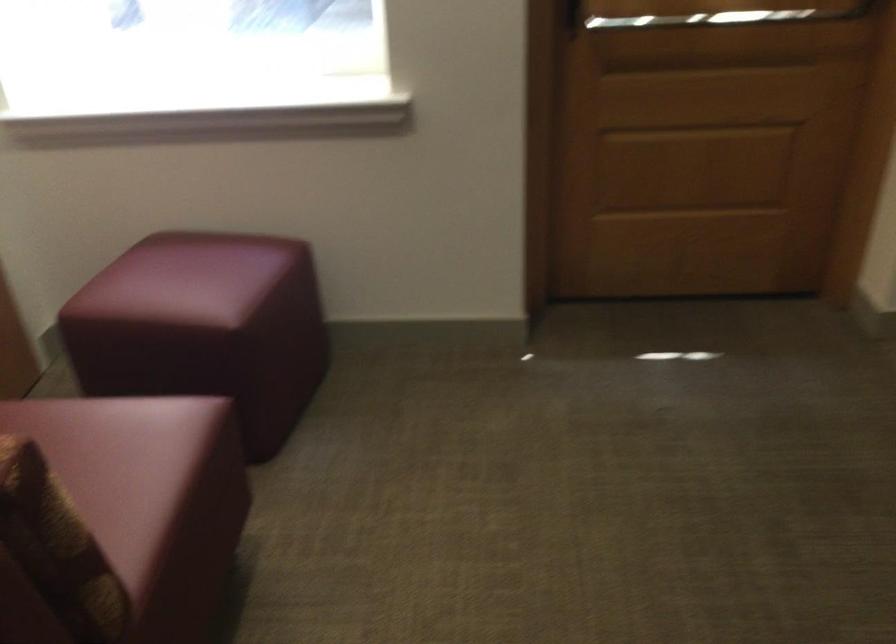
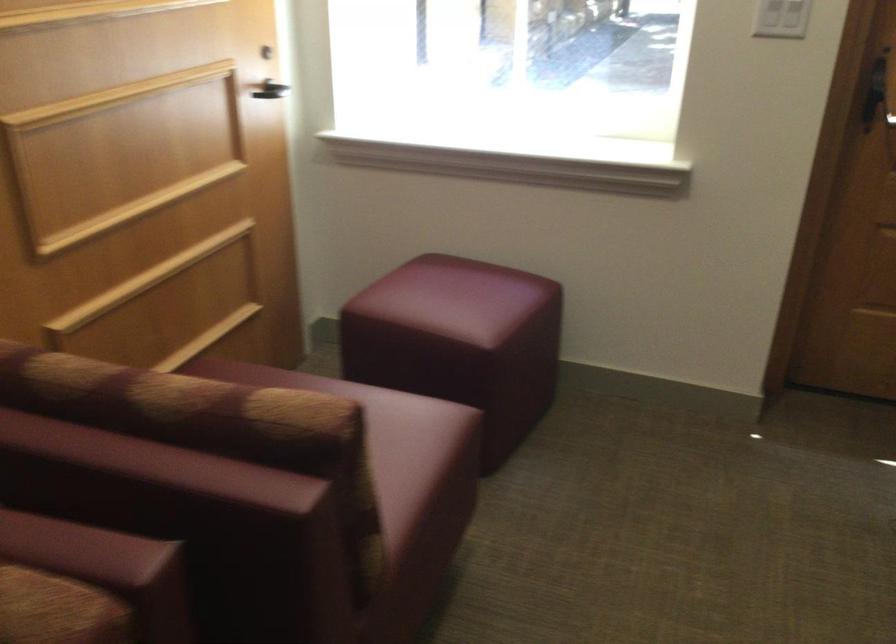
The point at (200, 323) is marked in the first image. Where is the corresponding point in the second image?

(460, 342)